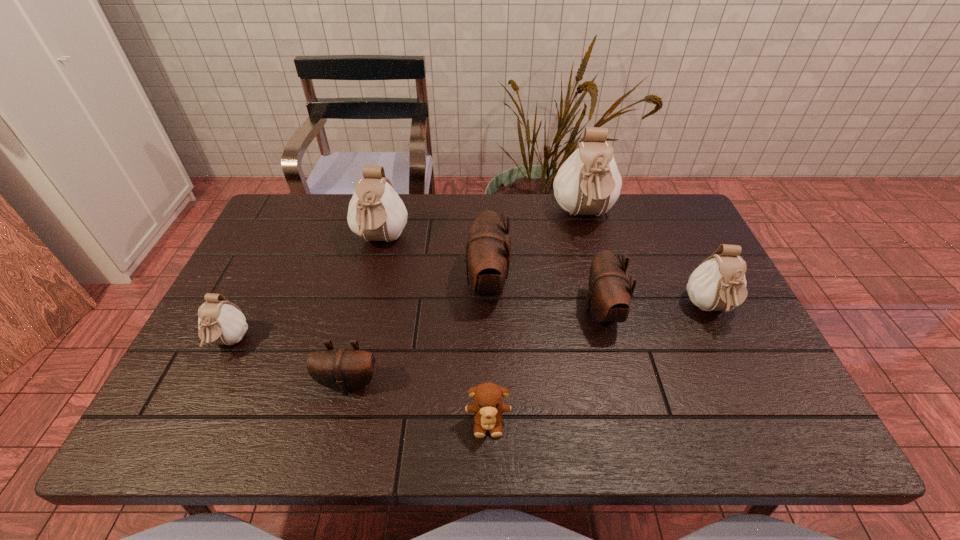
At what (x,y) coordinates should I click in order to perform the action: click on vacant space located 0.120m with the flap open on the second smallest brown pouch. Please return your answer as a coordinate pair (x, y). Looking at the image, I should click on (537, 311).

Find the location of `free space located 0.070m with the flap open on the second smallest brown pouch`. free space located 0.070m with the flap open on the second smallest brown pouch is located at coordinates click(556, 311).

This screenshot has height=540, width=960. What are the coordinates of `free location located 0.340m with the flap open on the second smallest brown pouch` in the screenshot? It's located at (450, 311).

I want to click on vacant space located 0.070m on the front-facing side of the leftmost white pouch, so click(204, 391).

Locate an element on the screen. Image resolution: width=960 pixels, height=540 pixels. vacant space located 0.090m with the flap open on the smallest brown pouch is located at coordinates (336, 437).

You are a GUI agent. You are given a task and a screenshot of the screen. Output one action in this format:
    pyautogui.click(x=<x>, y=<y>)
    Task: Click on the object located at the near edge
    The image size is (960, 540).
    Given the screenshot: What is the action you would take?
    pyautogui.click(x=488, y=406)

Where is `object present at the left edge`? This screenshot has height=540, width=960. object present at the left edge is located at coordinates (220, 321).

In order to click on object present at the right edge in this screenshot , I will do `click(718, 284)`.

At what (x,y) coordinates should I click in order to perform the action: click on vacant space at the far edge of the desktop. Please return your answer as a coordinate pair (x, y). This screenshot has width=960, height=540. Looking at the image, I should click on (x=506, y=220).

Where is `free space at the near edge of the desktop`? This screenshot has height=540, width=960. free space at the near edge of the desktop is located at coordinates (528, 426).